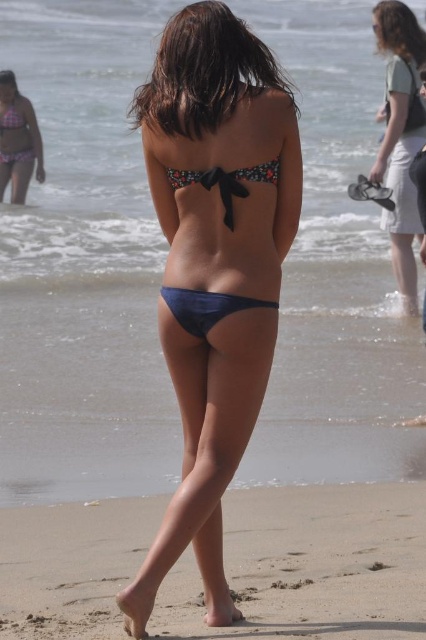
You are a photographer trying to capture the woman in the matte floral bikini top at center and the sandy tan at lower center. Based on their heights, which one should you focus on first if you want to ensure both are in frame without cropping?

The matte floral bikini top at center is taller than the sandy tan at lower center, so you should focus on the matte floral bikini top at center first to ensure both fit within the frame.

In the scene shown: You are a photographer trying to capture the woman in the bikini. You notice the sandy tan at lower center and the matte black bikini top at upper center. Which object is closer to the camera?

The sandy tan at lower center is closer to the camera because it is not as tall as the matte black bikini top at upper center, indicating it is positioned in front.